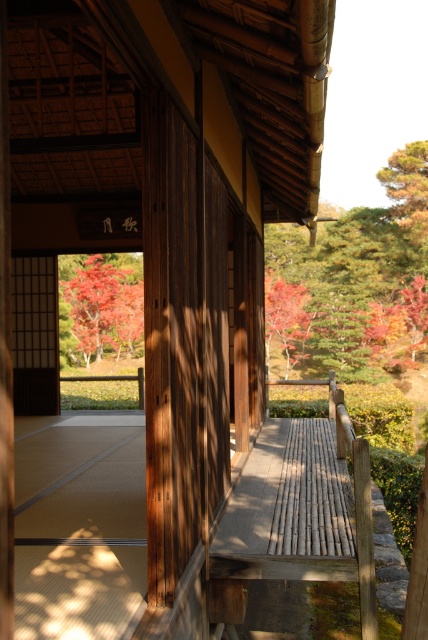
Question: Can you confirm if autumn leaves at upper right is positioned above vivid red leaves at center?

Choices:
 (A) yes
 (B) no

Answer: (A)

Question: Does autumn leaves at upper right appear under bamboo rail at center?

Choices:
 (A) yes
 (B) no

Answer: (B)

Question: Which object appears farthest from the camera in this image?

Choices:
 (A) vivid red leaves at center
 (B) bamboo rail at center
 (C) autumn leaves at upper right

Answer: (A)

Question: Which object appears closest to the camera in this image?

Choices:
 (A) bamboo rail at center
 (B) autumn leaves at upper right
 (C) vivid red leaves at center

Answer: (A)

Question: Which object appears closest to the camera in this image?

Choices:
 (A) autumn leaves at upper right
 (B) vivid red leaves at center
 (C) bamboo rail at center

Answer: (C)

Question: Observing the image, what is the correct spatial positioning of autumn leaves at upper right in reference to bamboo rail at center?

Choices:
 (A) left
 (B) right

Answer: (B)